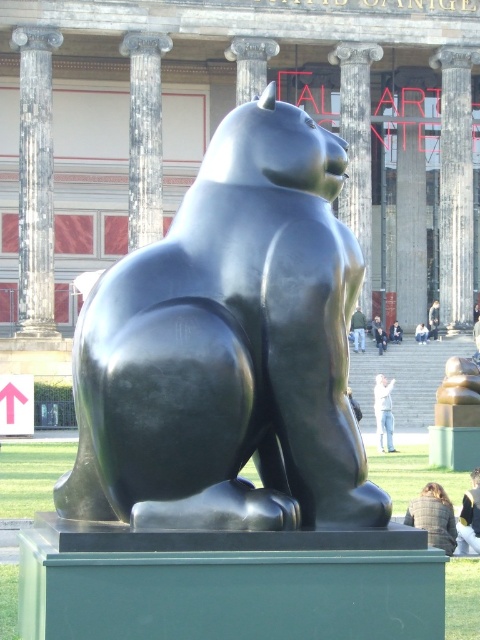
You are standing in front of the sculpture and notice a point marked at coordinates (144, 134). Based on the scene description, what object is located at that point?

The point at coordinates (144, 134) corresponds to the polished marble column at center.

You are standing in front of the sculpture and want to determine which of the two points, point (34,173) or point (355,337), is closer to you. Based on the sculpture and its pedestal, which point is nearer?

Point (34,173) is closer to the viewer than point (355,337).